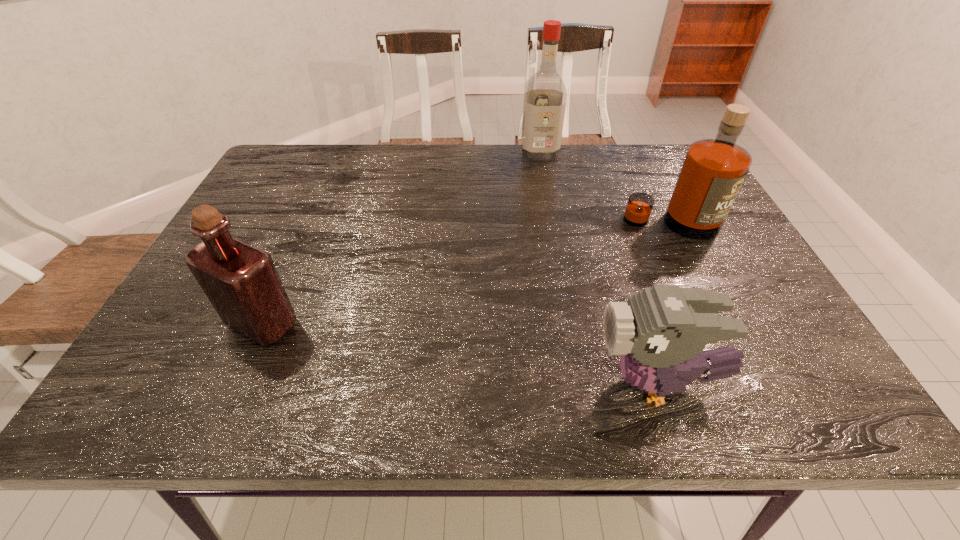
Find the location of a particular element. The width and height of the screenshot is (960, 540). blank space at the left edge is located at coordinates (198, 342).

In the image, there is a desktop. Where is `blank space at the right edge`? This screenshot has height=540, width=960. blank space at the right edge is located at coordinates (722, 226).

At what (x,y) coordinates should I click in order to perform the action: click on blank space at the far left corner of the desktop. Please return your answer as a coordinate pair (x, y). Image resolution: width=960 pixels, height=540 pixels. Looking at the image, I should click on (294, 154).

The width and height of the screenshot is (960, 540). I want to click on free point between the nearest object and the tallest liquor, so click(x=598, y=268).

Identify the location of empty space between the farthest liquor and the second nearest liquor. (606, 188).

Identify the location of unoccupied position between the second nearest object and the second farthest liquor. (467, 274).

You are a GUI agent. You are given a task and a screenshot of the screen. Output one action in this format:
    pyautogui.click(x=<x>, y=<y>)
    Task: Click on the vacant region between the farthest liquor and the third nearest object
    The height and width of the screenshot is (540, 960).
    Given the screenshot: What is the action you would take?
    pyautogui.click(x=606, y=188)

Identify the location of free space between the nearest object and the farthest liquor. (598, 268).

You are a GUI agent. You are given a task and a screenshot of the screen. Output one action in this format:
    pyautogui.click(x=<x>, y=<y>)
    Task: Click on the vacant area that lies between the rightmost liquor and the nearest liquor
    Image resolution: width=960 pixels, height=540 pixels.
    Given the screenshot: What is the action you would take?
    pyautogui.click(x=467, y=274)

What are the coordinates of `vacant area that lies between the second nearest liquor and the farthest object` in the screenshot? It's located at click(x=606, y=188).